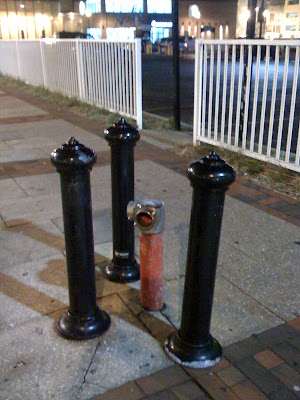
Identify the location of brick floor. tap(253, 377), tap(181, 391), tap(29, 165), tap(20, 118).